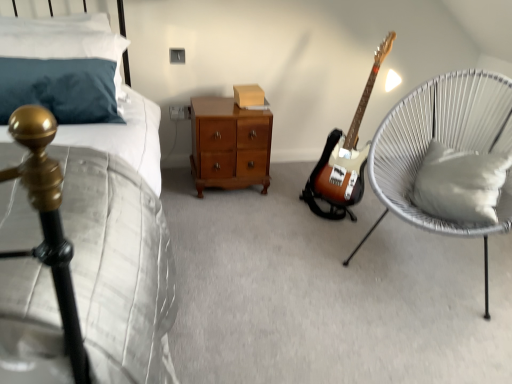
Locate an element on the screen. free spot below white woven chair at right (from a real-world perspective) is located at coordinates (429, 252).